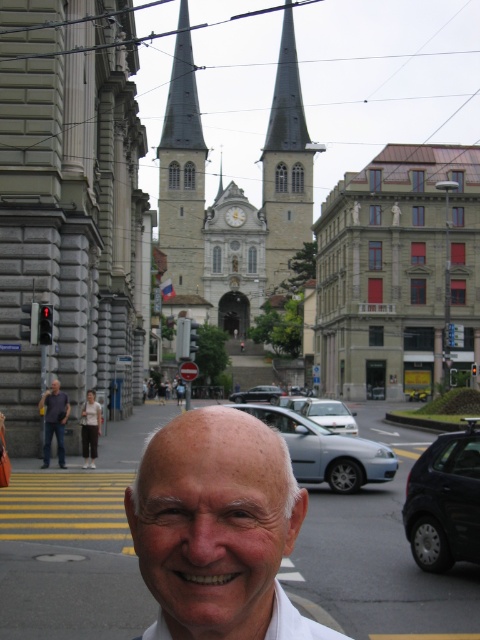
You are a photographer trying to capture the church spires in the background while focusing on the man in the foreground. You notice a specific point marked at coordinates (x=295, y=621). Can you determine if this point is located on the man or the church?

The point at coordinates (x=295, y=621) is on the white cotton shirt at center, which belongs to the man in the foreground. Therefore, the point is located on the man.

In the scene shown: You are a photographer setting up a tripod to take a portrait of the man in the white cotton dress shirt at lower left. You want to ensure the black glossy car at lower right does not appear in the background. Since the car is taller than the shirt, how should you adjust your camera angle?

Since the black glossy car at lower right is taller than the white cotton dress shirt at lower left, you should lower your camera angle to avoid capturing the car in the background while focusing on the man in the white cotton dress shirt at lower left.